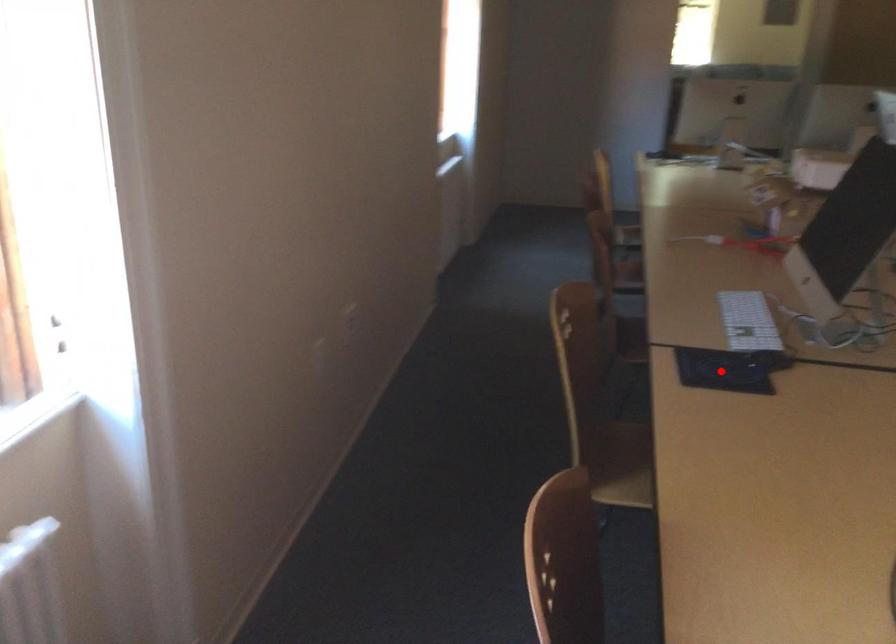
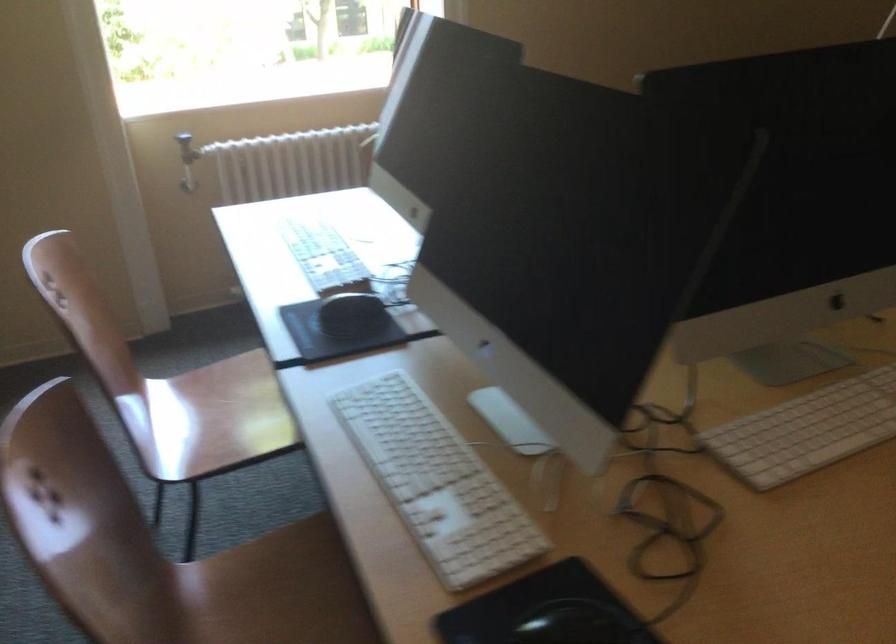
Question: I am providing you with two images of the same scene from different viewpoints. A red point is marked on the first image. Is the red point's position out of view in image 2?

Choices:
 (A) Yes
 (B) No

Answer: (A)